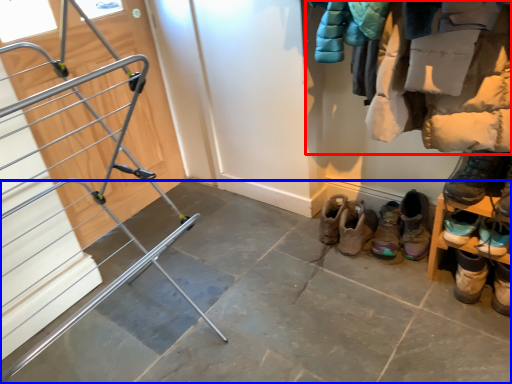
Question: Among these objects, which one is farthest to the camera, closet (highlighted by a red box) or concrete (highlighted by a blue box)?

Choices:
 (A) closet
 (B) concrete

Answer: (A)